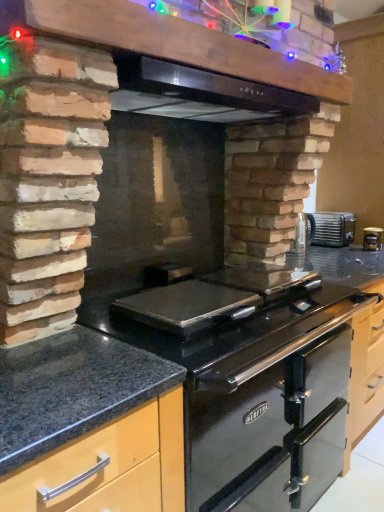
Question: Is metallic black vent at upper center oriented towards granite countertop at lower left, placed as the second countertop when sorted from left to right?

Choices:
 (A) yes
 (B) no

Answer: (B)

Question: Does metallic black vent at upper center contain granite countertop at lower left, placed as the second countertop when sorted from left to right?

Choices:
 (A) no
 (B) yes

Answer: (A)

Question: Can you confirm if metallic black vent at upper center is wider than granite countertop at lower left, placed as the second countertop when sorted from left to right?

Choices:
 (A) yes
 (B) no

Answer: (B)

Question: From the image's perspective, would you say metallic black vent at upper center is shown under granite countertop at lower left, the 1th countertop viewed from the right?

Choices:
 (A) yes
 (B) no

Answer: (B)

Question: Considering the relative sizes of metallic black vent at upper center and granite countertop at lower left, placed as the second countertop when sorted from left to right, in the image provided, is metallic black vent at upper center shorter than granite countertop at lower left, placed as the second countertop when sorted from left to right,?

Choices:
 (A) no
 (B) yes

Answer: (B)

Question: From the image's perspective, relative to granite countertop at lower left, the 1th countertop viewed from the right, is metallic silver toaster at upper center above or below?

Choices:
 (A) above
 (B) below

Answer: (A)

Question: From a real-world perspective, is metallic silver toaster at upper center positioned above or below granite countertop at lower left, the 1th countertop viewed from the right?

Choices:
 (A) above
 (B) below

Answer: (A)

Question: Looking at their shapes, would you say metallic silver toaster at upper center is wider or thinner than granite countertop at lower left, the 1th countertop viewed from the right?

Choices:
 (A) thin
 (B) wide

Answer: (A)

Question: Is metallic silver toaster at upper center bigger or smaller than granite countertop at lower left, the 1th countertop viewed from the right?

Choices:
 (A) small
 (B) big

Answer: (A)

Question: Relative to granite at center, which is the second countertop from right to left, is granite countertop at lower left, the 1th countertop viewed from the right, in front or behind?

Choices:
 (A) front
 (B) behind

Answer: (B)

Question: Does point (253, 508) appear closer or farther from the camera than point (81, 408)?

Choices:
 (A) farther
 (B) closer

Answer: (A)

Question: Looking at their shapes, would you say granite countertop at lower left, the 1th countertop viewed from the right, is wider or thinner than granite at center, which is the first countertop in left-to-right order?

Choices:
 (A) thin
 (B) wide

Answer: (B)

Question: Is granite countertop at lower left, the 1th countertop viewed from the right, bigger or smaller than granite at center, which is the second countertop from right to left?

Choices:
 (A) big
 (B) small

Answer: (A)

Question: Considering the relative positions of matte black canister at upper right and metallic black vent at upper center in the image provided, is matte black canister at upper right to the left or to the right of metallic black vent at upper center?

Choices:
 (A) right
 (B) left

Answer: (A)

Question: Is matte black canister at upper right inside the boundaries of metallic black vent at upper center, or outside?

Choices:
 (A) outside
 (B) inside

Answer: (A)